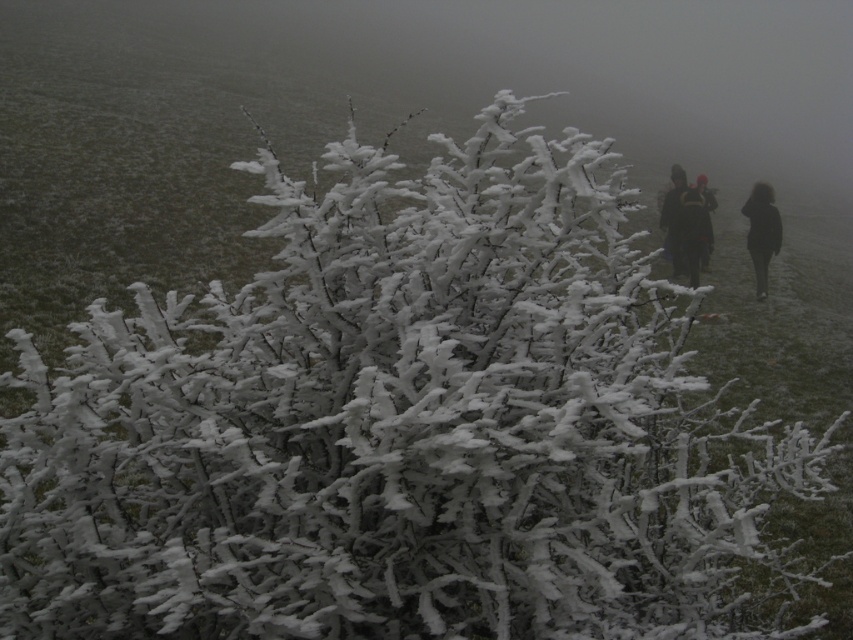
Looking at this image, you are a photographer trying to capture the two figures in the snow scene. You notice the black matte coat at right and the dark fabric jacket at right. Which one is closer to the camera so that it appears more prominent in your photo?

The black matte coat at right is closer to the camera because the dark fabric jacket at right is behind it, making the black matte coat appear more prominent in the photo.

You are standing in the snowy bush area and want to greet the people in the dark fabric jacket at right and dark blue jacket at right. Which person should you approach first to reach the other one?

You should approach the dark fabric jacket at right first because it is closer to you than the dark blue jacket at right, so after greeting them you can proceed to the other person.